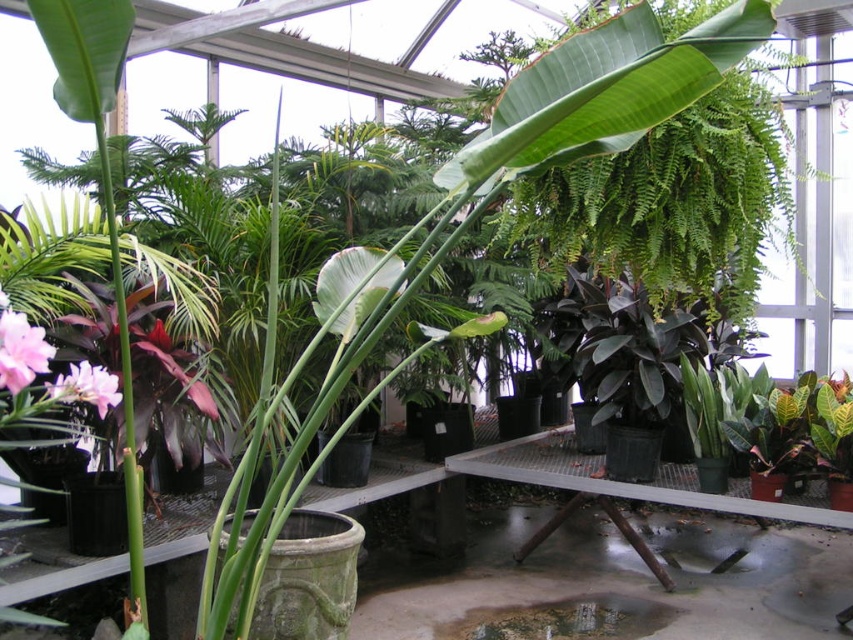
How much distance is there between pink matte flower at lower left and pink matte flower at center?

pink matte flower at lower left and pink matte flower at center are 17.27 centimeters apart.

Who is higher up, pink matte flower at lower left or pink matte flower at center?

Positioned higher is pink matte flower at lower left.

Find the location of a particular element. This screenshot has width=853, height=640. pink matte flower at lower left is located at coordinates (20, 352).